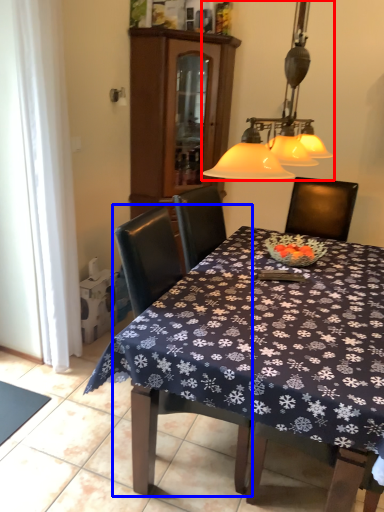
Question: Which of the following is the closest to the observer, lamp (highlighted by a red box) or chair (highlighted by a blue box)?

Choices:
 (A) lamp
 (B) chair

Answer: (A)